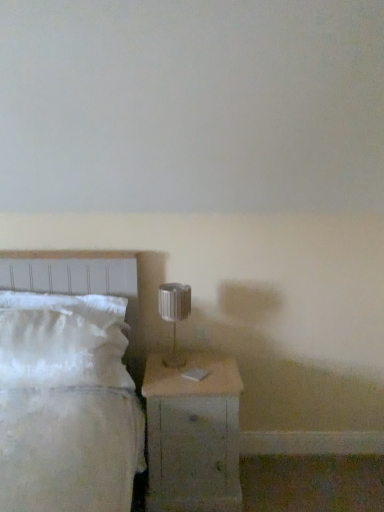
Question: In terms of width, does metallic silver table lamp at center look wider or thinner when compared to white fluffy pillow at left?

Choices:
 (A) wide
 (B) thin

Answer: (B)

Question: From the image's perspective, relative to white fluffy pillow at left, is metallic silver table lamp at center above or below?

Choices:
 (A) above
 (B) below

Answer: (A)

Question: Estimate the real-world distances between objects in this image. Which object is closer to the metallic silver table lamp at center?

Choices:
 (A) wooden nightstand at lower right
 (B) white soft bed at left
 (C) white fluffy pillow at left

Answer: (A)

Question: Estimate the real-world distances between objects in this image. Which object is farther from the wooden nightstand at lower right?

Choices:
 (A) metallic silver table lamp at center
 (B) white soft bed at left
 (C) white fluffy pillow at left

Answer: (B)